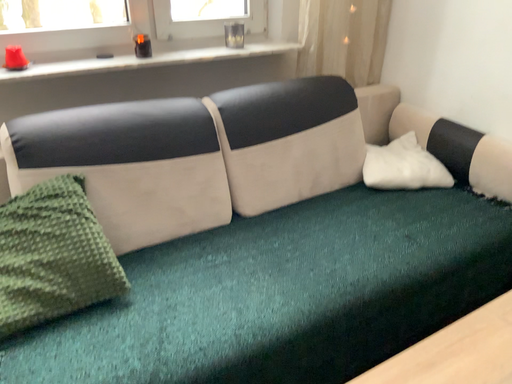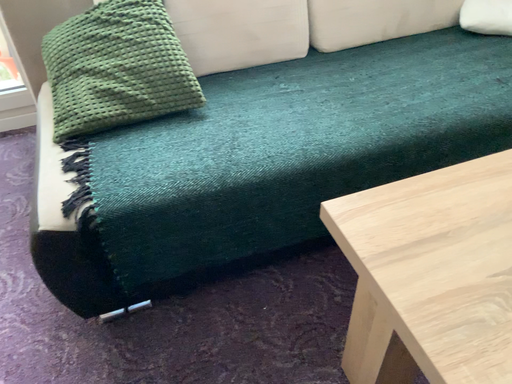
Question: How did the camera likely rotate when shooting the video?

Choices:
 (A) rotated upward
 (B) rotated downward

Answer: (B)